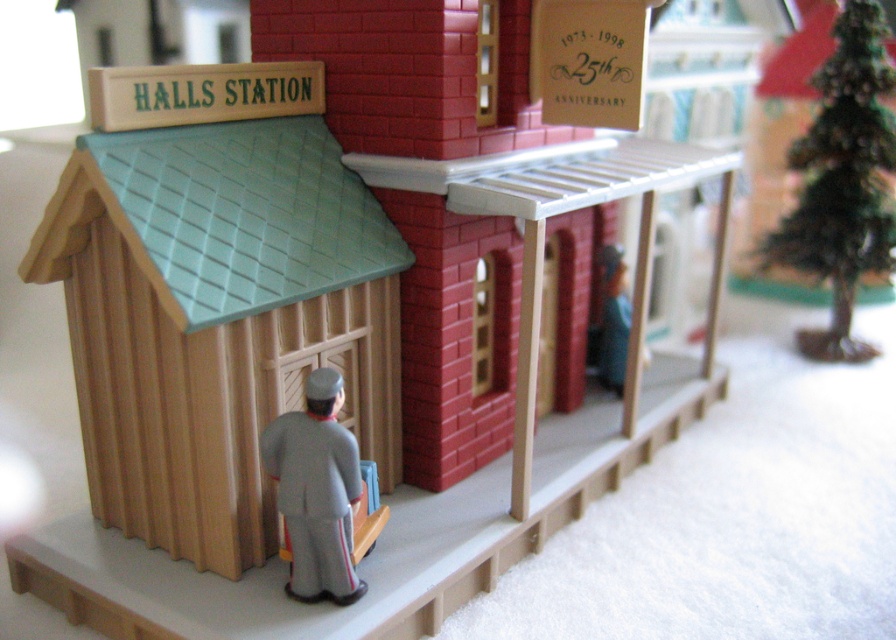
Does green matte christmas tree at right have a greater width compared to gray fabric uniform at center?

Yes, green matte christmas tree at right is wider than gray fabric uniform at center.

The width and height of the screenshot is (896, 640). In order to click on green matte christmas tree at right in this screenshot , I will do `click(843, 180)`.